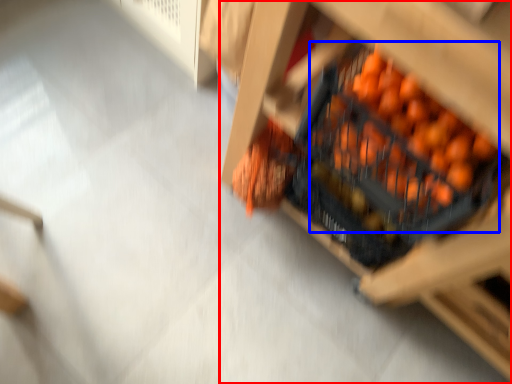
Question: Which object is closer to the camera taking this photo, furniture (highlighted by a red box) or fruit (highlighted by a blue box)?

Choices:
 (A) furniture
 (B) fruit

Answer: (A)